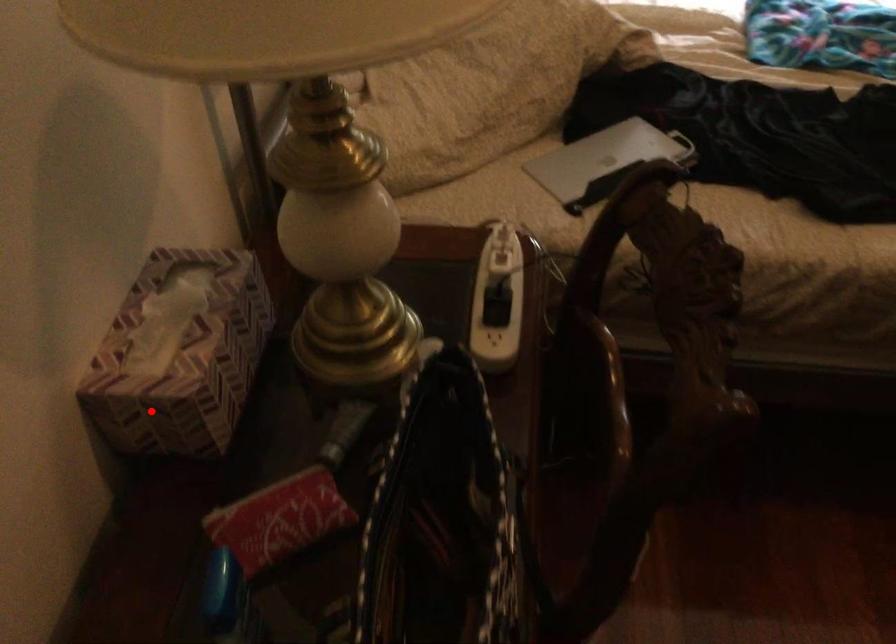
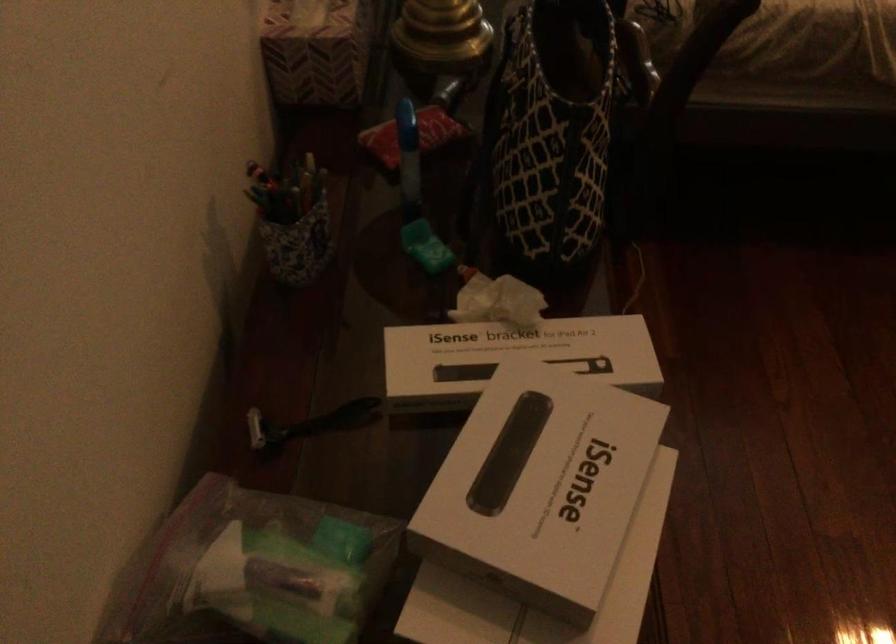
The point at the highlighted location is marked in the first image. Where is the corresponding point in the second image?

(315, 51)